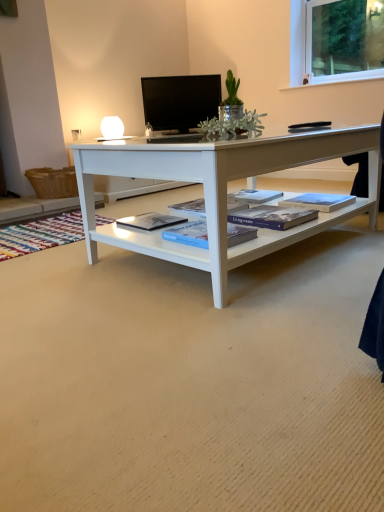
Question: Can you confirm if black glossy tv at upper center is thinner than hardcover book at center, the 4th book viewed from the right?

Choices:
 (A) yes
 (B) no

Answer: (A)

Question: Does black glossy tv at upper center have a larger size compared to hardcover book at center, the first book positioned from the left?

Choices:
 (A) no
 (B) yes

Answer: (B)

Question: Considering the relative positions of black glossy tv at upper center and hardcover book at center, the 4th book viewed from the right, in the image provided, is black glossy tv at upper center to the left of hardcover book at center, the 4th book viewed from the right, from the viewer's perspective?

Choices:
 (A) yes
 (B) no

Answer: (B)

Question: Does black glossy tv at upper center lie behind hardcover book at center, the 4th book viewed from the right?

Choices:
 (A) no
 (B) yes

Answer: (B)

Question: Is black glossy tv at upper center oriented away from hardcover book at center, the first book positioned from the left?

Choices:
 (A) yes
 (B) no

Answer: (B)

Question: From the image's perspective, is black glossy tv at upper center over hardcover book at center, the first book positioned from the left?

Choices:
 (A) no
 (B) yes

Answer: (B)

Question: From the image's perspective, is blue hardcover book at center, which is the fourth book from left to right, below blue matte book at center, the 2th book when ordered from right to left?

Choices:
 (A) yes
 (B) no

Answer: (B)

Question: Could you tell me if blue hardcover book at center, which is the fourth book from left to right, is facing blue matte book at center, arranged as the 3th book when viewed from the left?

Choices:
 (A) yes
 (B) no

Answer: (B)

Question: Can you confirm if blue hardcover book at center, which is the 1th book in right-to-left order, is thinner than blue matte book at center, the 2th book when ordered from right to left?

Choices:
 (A) no
 (B) yes

Answer: (B)

Question: Considering the relative sizes of blue hardcover book at center, which is the fourth book from left to right, and blue matte book at center, arranged as the 3th book when viewed from the left, in the image provided, is blue hardcover book at center, which is the fourth book from left to right, shorter than blue matte book at center, arranged as the 3th book when viewed from the left,?

Choices:
 (A) yes
 (B) no

Answer: (B)

Question: Is blue hardcover book at center, which is the 1th book in right-to-left order, further to camera compared to blue matte book at center, arranged as the 3th book when viewed from the left?

Choices:
 (A) yes
 (B) no

Answer: (A)

Question: Is blue hardcover book at center, which is the fourth book from left to right, positioned in front of blue matte book at center, the 2th book when ordered from right to left?

Choices:
 (A) yes
 (B) no

Answer: (B)

Question: Is blue matte book at center, arranged as the third book when viewed from the right, aimed at hardcover book at center, the first book positioned from the left?

Choices:
 (A) no
 (B) yes

Answer: (B)